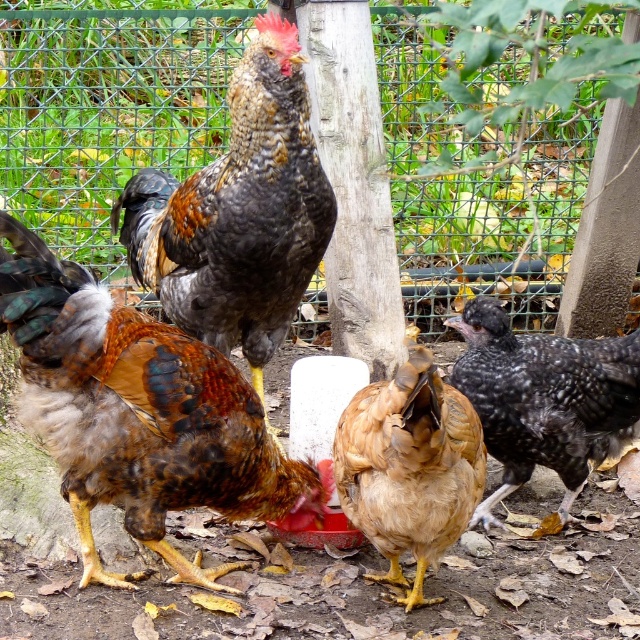
Can you confirm if speckled feathered rooster at center is positioned to the right of speckled black chicken at right?

In fact, speckled feathered rooster at center is to the left of speckled black chicken at right.

Find the location of a particular element. speckled feathered rooster at center is located at coordinates (237, 212).

Is point (145, 356) positioned after point (289, 134)?

No, (145, 356) is closer to viewer.

Which is behind, point (4, 296) or point (289, 77)?

Point (289, 77)

Find the location of `brown speckled feathers at center`. brown speckled feathers at center is located at coordinates (140, 413).

Which is more to the left, brown speckled feathers at center or golden feathered chicken at center?

From the viewer's perspective, brown speckled feathers at center appears more on the left side.

Between point (99, 392) and point (385, 596), which one is positioned in front?

Point (99, 392)

Between point (288, 467) and point (436, 486), which one is positioned behind?

The point (288, 467) is more distant.

At what (x,y) coordinates should I click in order to perform the action: click on brown speckled feathers at center. Please return your answer as a coordinate pair (x, y). Looking at the image, I should click on (140, 413).